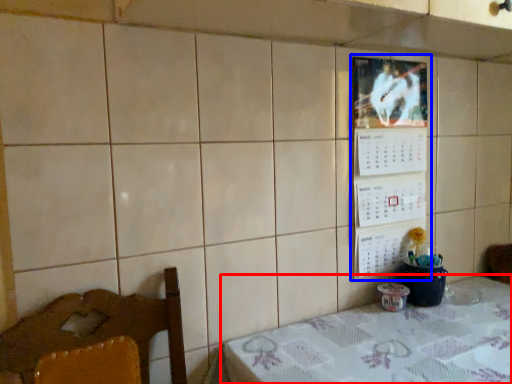
Question: Which object appears closest to the camera in this image, table (highlighted by a red box) or bulletin board (highlighted by a blue box)?

Choices:
 (A) table
 (B) bulletin board

Answer: (A)